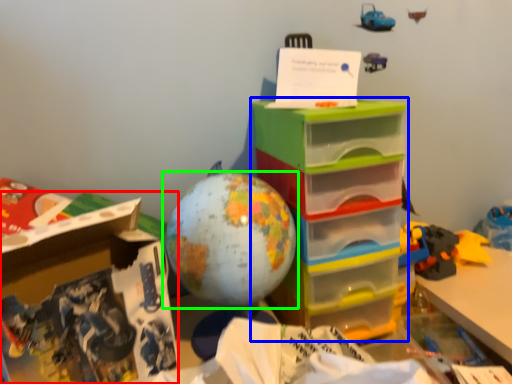
Question: Which object is positioned farthest from cardboard box (highlighted by a red box)? Select from storage box (highlighted by a blue box) and toy (highlighted by a green box).

Choices:
 (A) storage box
 (B) toy

Answer: (A)